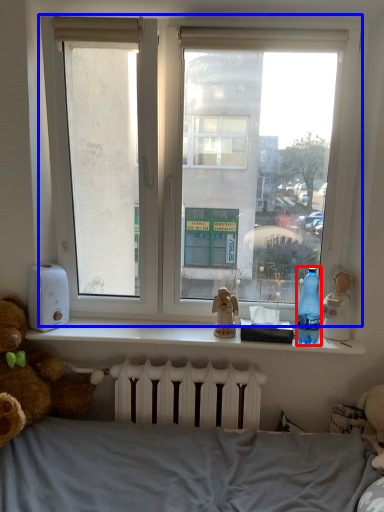
Question: Among these objects, which one is nearest to the camera, bottle (highlighted by a red box) or window (highlighted by a blue box)?

Choices:
 (A) bottle
 (B) window

Answer: (B)